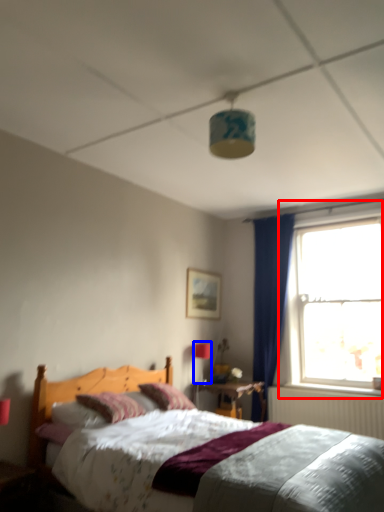
Question: Which of the following is the farthest to the observer, window (highlighted by a red box) or light fixture (highlighted by a blue box)?

Choices:
 (A) window
 (B) light fixture

Answer: (B)